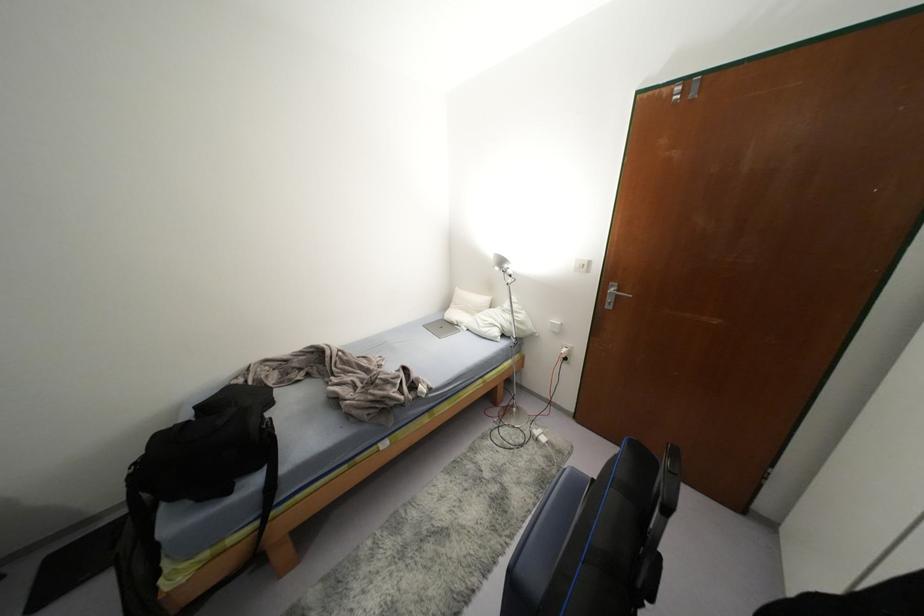
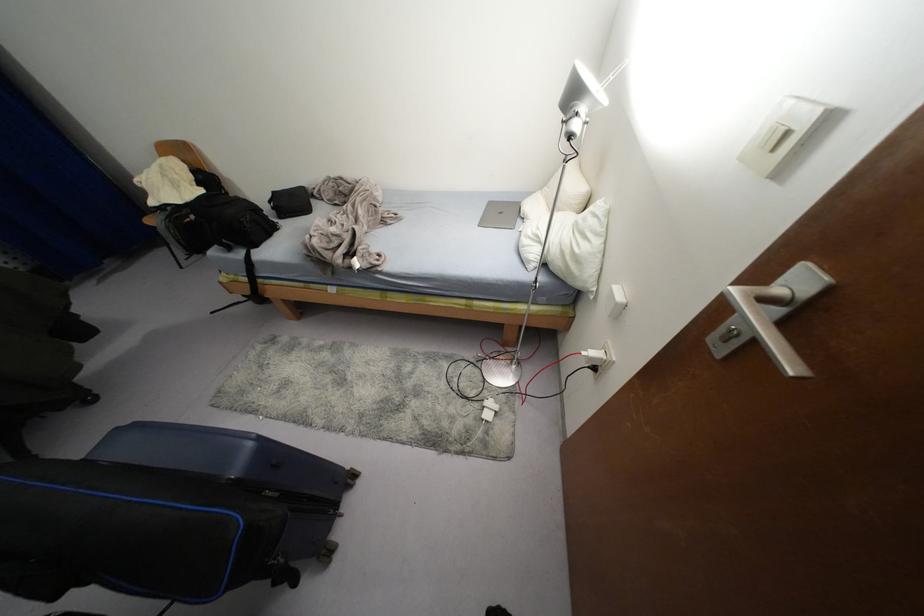
Find the pixel in the second image that matches (195,407) in the first image.

(274, 192)